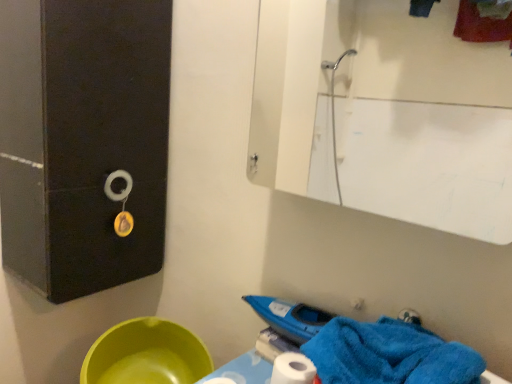
The image size is (512, 384). Describe the element at coordinates (419, 117) in the screenshot. I see `white glossy mirror at upper center` at that location.

Locate an element on the screen. This screenshot has height=384, width=512. green plastic basin at lower left is located at coordinates (146, 355).

The image size is (512, 384). What are the coordinates of `blue soft towel at lower right` in the screenshot? It's located at point(389,354).

The height and width of the screenshot is (384, 512). Find the location of `white glossy mirror at upper center`. white glossy mirror at upper center is located at coordinates (419, 117).

Is green plastic basin at lower left to the right of white glossy mirror at upper center from the viewer's perspective?

Incorrect, green plastic basin at lower left is not on the right side of white glossy mirror at upper center.

Does green plastic basin at lower left have a larger size compared to white glossy mirror at upper center?

No, green plastic basin at lower left is not bigger than white glossy mirror at upper center.

Can you tell me how much green plastic basin at lower left and white glossy mirror at upper center differ in facing direction?

green plastic basin at lower left and white glossy mirror at upper center are facing 0.567 degrees away from each other.

Considering the relative sizes of green plastic basin at lower left and white glossy mirror at upper center in the image provided, is green plastic basin at lower left thinner than white glossy mirror at upper center?

No.

From a real-world perspective, is blue soft towel at lower right located higher than white glossy mirror at upper center?

No.

Looking at this image, which point is more forward, (450, 383) or (398, 64)?

The point (450, 383) is in front.

Is blue soft towel at lower right in front of or behind white glossy mirror at upper center in the image?

In the image, blue soft towel at lower right appears in front of white glossy mirror at upper center.

Does blue soft towel at lower right have a lesser height compared to white glossy mirror at upper center?

Yes.

What's the angular difference between blue soft towel at lower right and green plastic basin at lower left's facing directions?

The facing directions of blue soft towel at lower right and green plastic basin at lower left are 6.38 degrees apart.

Does blue soft towel at lower right touch green plastic basin at lower left?

No, blue soft towel at lower right is not touching green plastic basin at lower left.

The height and width of the screenshot is (384, 512). What are the coordinates of `basin on the left side of blue soft towel at lower right` in the screenshot? It's located at (146, 355).

Considering the sizes of objects blue soft towel at lower right and green plastic basin at lower left in the image provided, who is shorter, blue soft towel at lower right or green plastic basin at lower left?

green plastic basin at lower left.

Looking at this image, is blue soft towel at lower right inside white glossy mirror at upper center?

That's incorrect, blue soft towel at lower right is not inside white glossy mirror at upper center.

Does point (433, 39) come closer to viewer compared to point (472, 362)?

No.

Which of these two, white glossy mirror at upper center or blue soft towel at lower right, is thinner?

white glossy mirror at upper center.

Between white glossy mirror at upper center and blue soft towel at lower right, which one has smaller size?

Smaller between the two is blue soft towel at lower right.

Is point (350, 155) positioned before point (110, 342)?

That is False.

Based on the photo, is white glossy mirror at upper center not within green plastic basin at lower left?

Yes, white glossy mirror at upper center is outside of green plastic basin at lower left.

Is white glossy mirror at upper center not close to green plastic basin at lower left?

Yes, white glossy mirror at upper center and green plastic basin at lower left are quite far apart.

Is green plastic basin at lower left situated inside blue soft towel at lower right or outside?

green plastic basin at lower left is spatially situated outside blue soft towel at lower right.

Can you confirm if green plastic basin at lower left is positioned to the left of blue soft towel at lower right?

Indeed, green plastic basin at lower left is positioned on the left side of blue soft towel at lower right.

Considering the relative sizes of green plastic basin at lower left and blue soft towel at lower right in the image provided, is green plastic basin at lower left thinner than blue soft towel at lower right?

No.

Identify the location of mirror on the right of green plastic basin at lower left. This screenshot has width=512, height=384. (419, 117).

In the image, there is a blue soft towel at lower right. Where is `mirror above it (from the image's perspective)`? Image resolution: width=512 pixels, height=384 pixels. mirror above it (from the image's perspective) is located at coordinates (419, 117).

Estimate the real-world distances between objects in this image. Which object is closer to white glossy mirror at upper center, green plastic basin at lower left or blue soft towel at lower right?

green plastic basin at lower left is positioned closer to the anchor white glossy mirror at upper center.

When comparing their distances from green plastic basin at lower left, does blue soft towel at lower right or white glossy mirror at upper center seem closer?

blue soft towel at lower right.

Which object lies further to the anchor point blue soft towel at lower right, white glossy mirror at upper center or green plastic basin at lower left?

white glossy mirror at upper center.

Consider the image. Estimate the real-world distances between objects in this image. Which object is closer to white glossy mirror at upper center, blue soft towel at lower right or green plastic basin at lower left?

green plastic basin at lower left is positioned closer to the anchor white glossy mirror at upper center.

Looking at the image, which one is located further to green plastic basin at lower left, white glossy mirror at upper center or blue soft towel at lower right?

Based on the image, white glossy mirror at upper center appears to be further to green plastic basin at lower left.

Consider the image. Estimate the real-world distances between objects in this image. Which object is further from blue soft towel at lower right, green plastic basin at lower left or white glossy mirror at upper center?

Among the two, white glossy mirror at upper center is located further to blue soft towel at lower right.

At what (x,y) coordinates should I click in order to perform the action: click on bath towel between white glossy mirror at upper center and green plastic basin at lower left vertically. Please return your answer as a coordinate pair (x, y). This screenshot has height=384, width=512. Looking at the image, I should click on (389, 354).